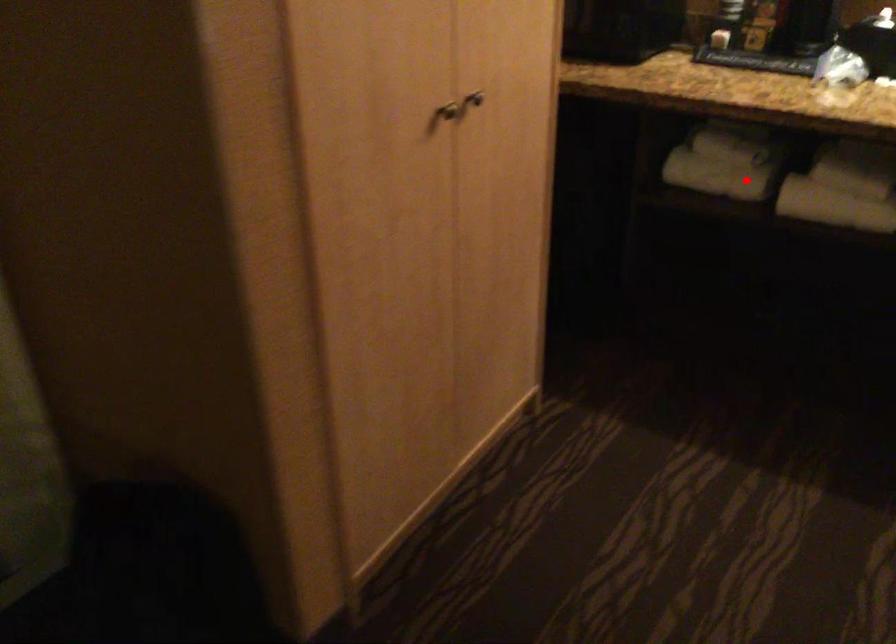
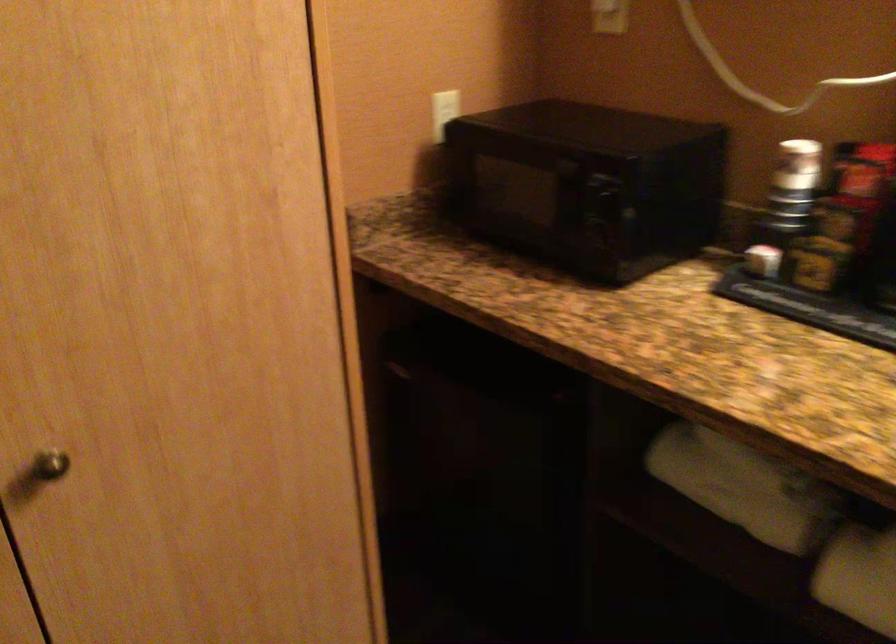
In the second image, find the point that corresponds to the highlighted location in the first image.

(764, 509)